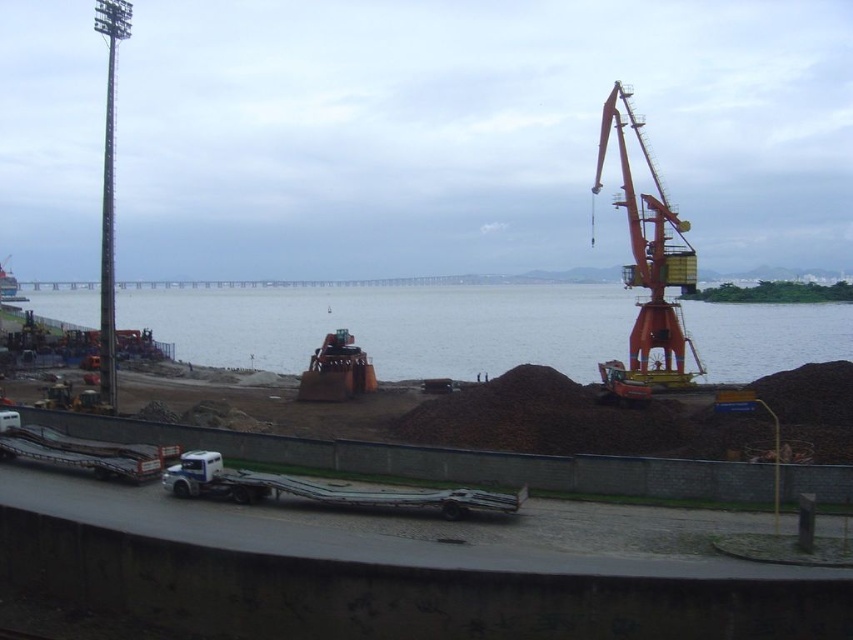
Can you confirm if blue water at center is positioned to the left of metallic orange boat at left?

Incorrect, blue water at center is not on the left side of metallic orange boat at left.

Which is below, blue water at center or metallic orange boat at left?

blue water at center is below.

Where is `blue water at center`? The image size is (853, 640). blue water at center is located at coordinates (393, 326).

Locate an element on the screen. This screenshot has height=640, width=853. blue water at center is located at coordinates (393, 326).

Does orange metallic crane at upper right have a lesser width compared to blue water at center?

Yes.

Does orange metallic crane at upper right have a greater height compared to blue water at center?

No, orange metallic crane at upper right is not taller than blue water at center.

This screenshot has height=640, width=853. I want to click on orange metallic crane at upper right, so click(407, 570).

Can you confirm if orange metallic crane at upper right is positioned to the left of orange metallic crane at right?

Indeed, orange metallic crane at upper right is positioned on the left side of orange metallic crane at right.

Is orange metallic crane at upper right behind orange metallic crane at right?

No, it is in front of orange metallic crane at right.

Which is behind, point (842, 314) or point (624, 161)?

Point (842, 314)

Identify the location of orange metallic crane at upper right. point(407,570).